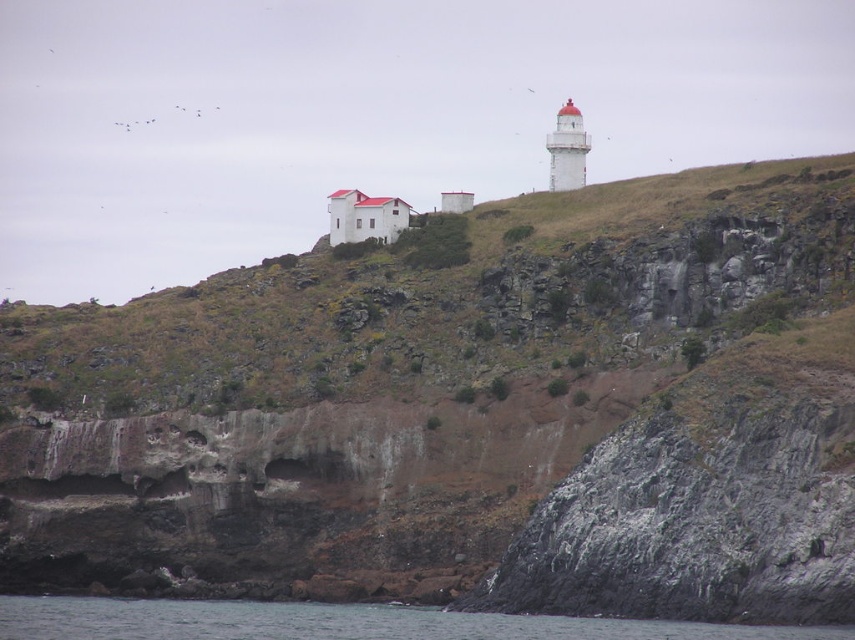
You are a maintenance worker needing to reach the white painted lighthouse at upper right from the transparent blue water at lower left. Given that your equipment can only carry you 60 meters, will you be able to make the journey?

The distance between the transparent blue water at lower left and the white painted lighthouse at upper right is 60.84 meters, which exceeds the equipment capacity of 60 meters. Therefore, you cannot reach the lighthouse with the current equipment.

You are standing at the base of the cliff and want to reach the lighthouse. The brown rocky hillside at upper center is part of the path. Can you estimate how far you need to climb to reach the lighthouse?

The brown rocky hillside at upper center is 373.41 feet from the viewer, so you need to climb approximately 373.41 feet to reach the lighthouse.

In the scene shown: You are standing at the base of the cliff near the main building. You see a point marked at coordinates point (446,296). Which direction should you walk to reach the brown rocky hillside at upper center from your current position?

The point (446,296) marks the brown rocky hillside at upper center. Since you are at the base of the cliff near the main building, which is positioned slightly lower than the lighthouse, you should walk upward towards the lighthouse to reach the brown rocky hillside at upper center.